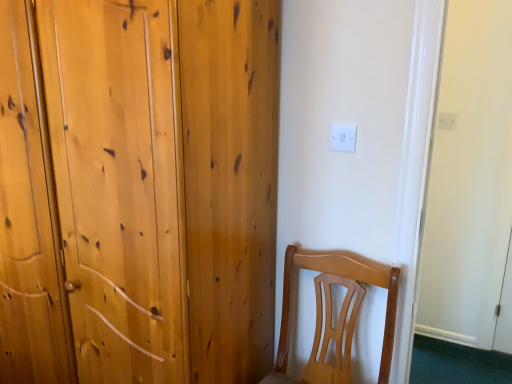
Question: Does point (x=340, y=137) appear closer or farther from the camera than point (x=118, y=170)?

Choices:
 (A) closer
 (B) farther

Answer: (B)

Question: Looking at their shapes, would you say white plastic electric outlet at upper center, the 1th electric outlet when ordered from bottom to top, is wider or thinner than natural wood wardrobe at left?

Choices:
 (A) wide
 (B) thin

Answer: (B)

Question: Which is farther from the natural wood wardrobe at left?

Choices:
 (A) white plastic electric outlet at upper right, which is the first electric outlet from back to front
 (B) light brown wood chair at lower right
 (C) white plastic electric outlet at upper center, the second electric outlet in the right-to-left sequence

Answer: (A)

Question: Estimate the real-world distances between objects in this image. Which object is closer to the white plastic electric outlet at upper right, the 2th electric outlet viewed from the left?

Choices:
 (A) light brown wood chair at lower right
 (B) white plastic electric outlet at upper center, arranged as the second electric outlet when viewed from the back
 (C) natural wood wardrobe at left

Answer: (B)